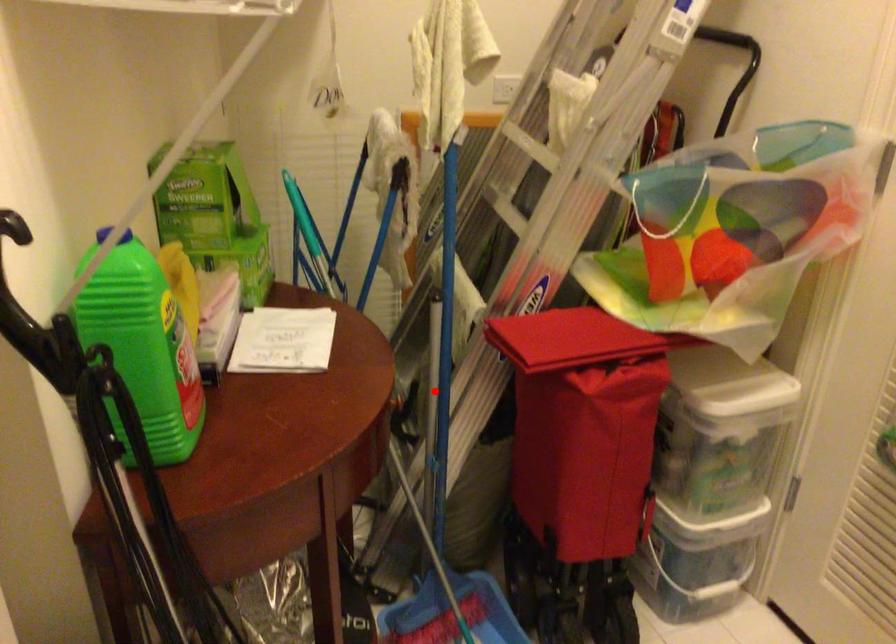
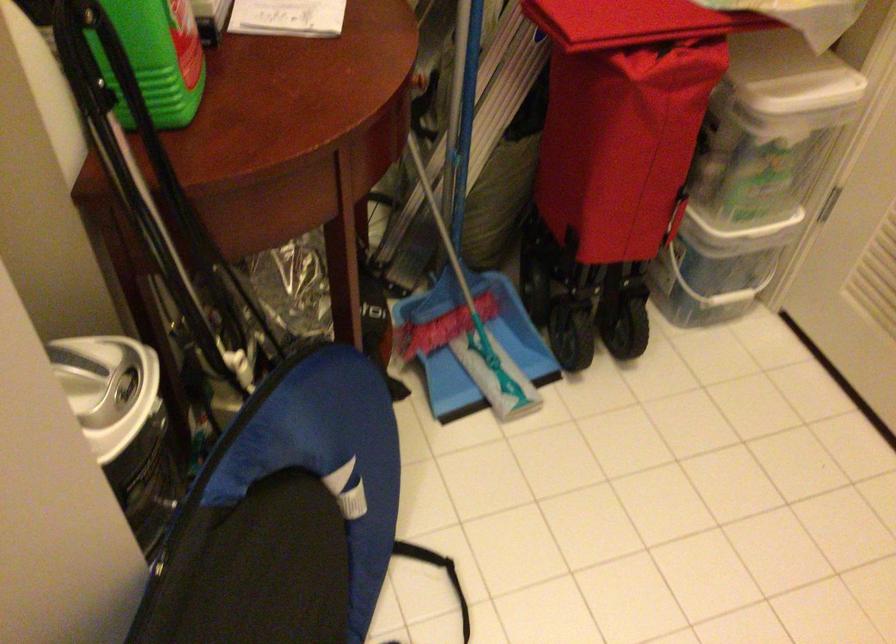
The point at the highlighted location is marked in the first image. Where is the corresponding point in the second image?

(460, 71)